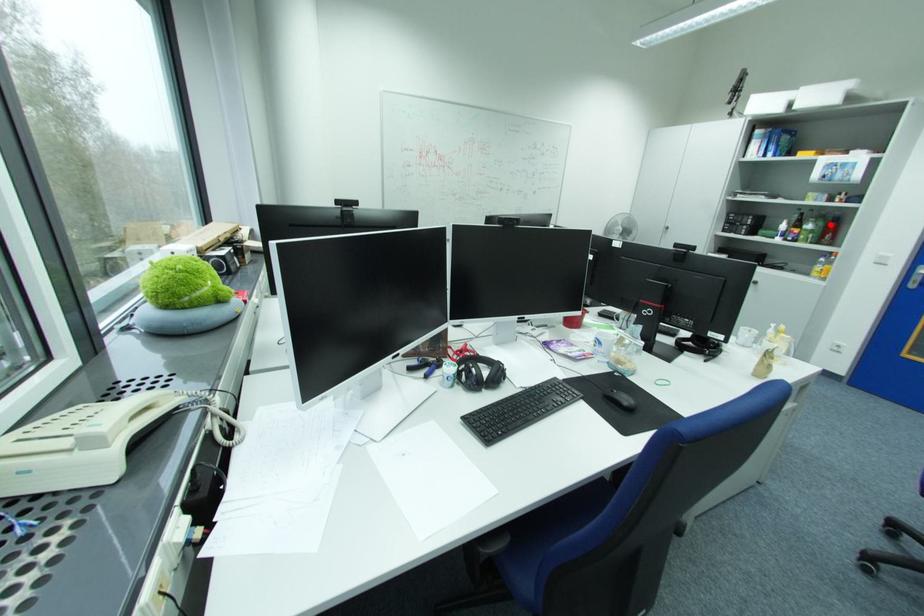
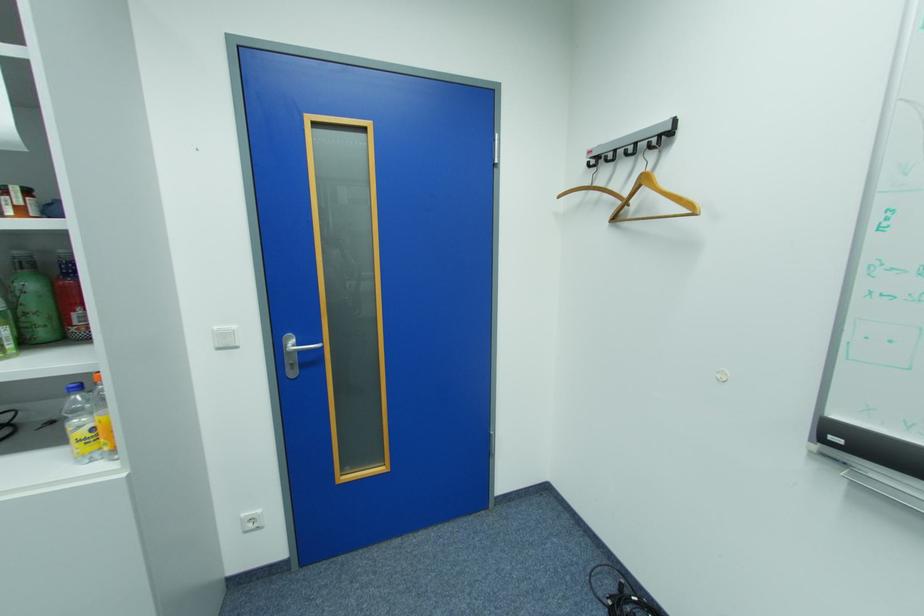
Where in the second image is the point corresponding to the highlighted location from the first image?

(41, 286)